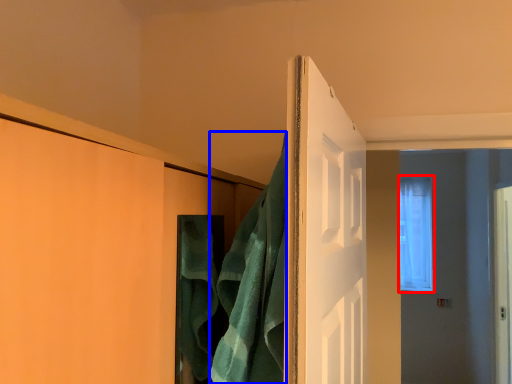
Question: Among these objects, which one is nearest to the camera, window (highlighted by a red box) or bath towel (highlighted by a blue box)?

Choices:
 (A) window
 (B) bath towel

Answer: (B)